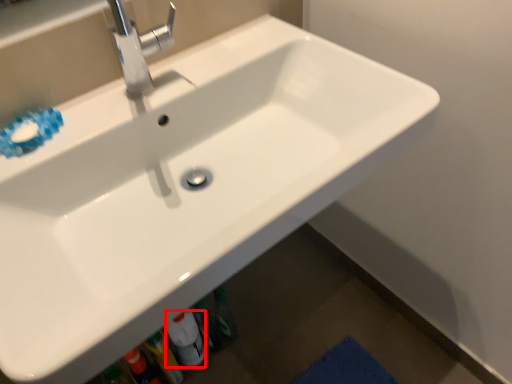
Question: From the image's perspective, what is the correct spatial positioning of bottle (annotated by the red box) in reference to tap?

Choices:
 (A) below
 (B) above

Answer: (A)